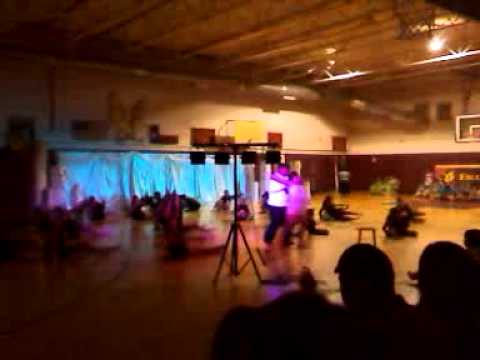
This screenshot has width=480, height=360. I want to click on ceiling, so click(271, 28).